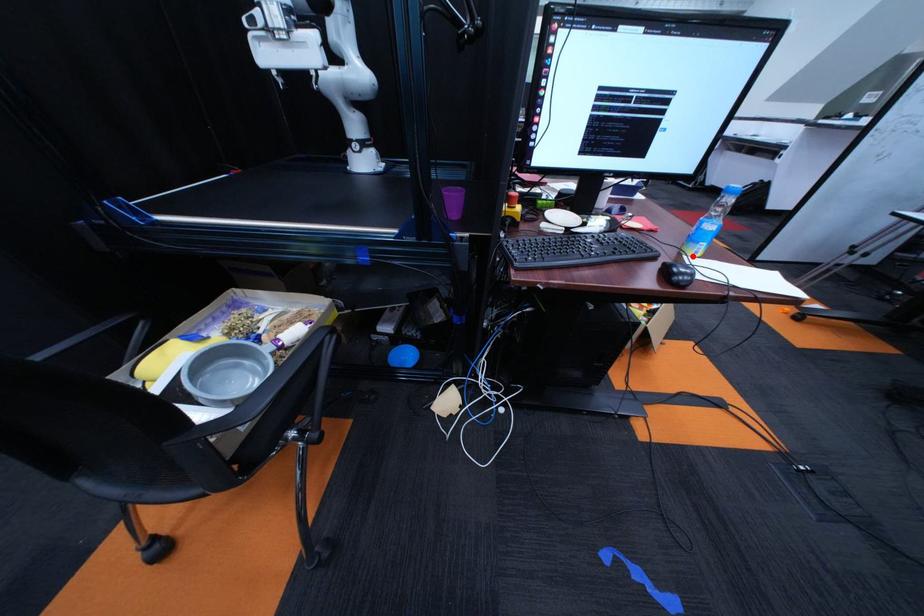
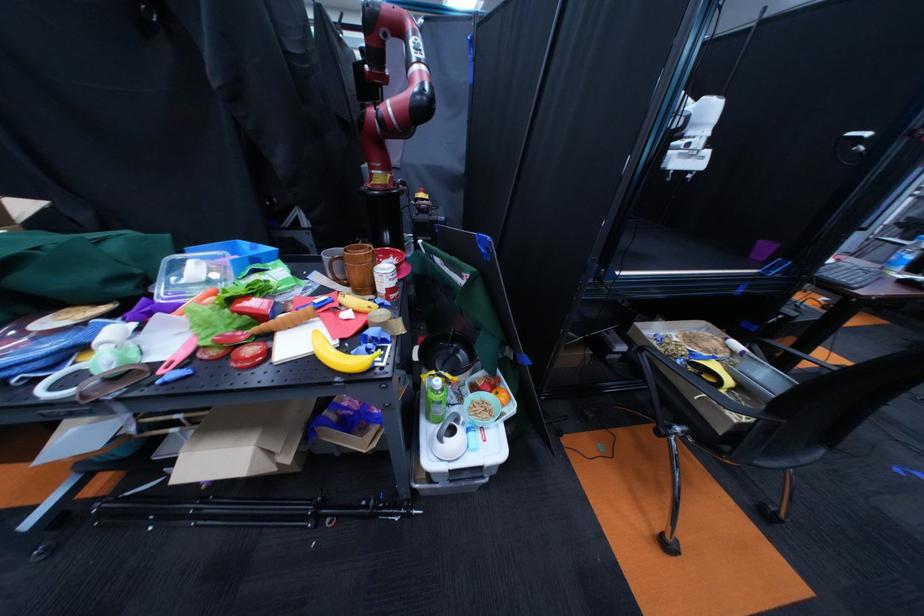
Question: I am providing you with two images of the same scene from different viewpoints. A red point is marked on the first image. Can you still see the location of the red point in image 2?

Choices:
 (A) Yes
 (B) No

Answer: (B)